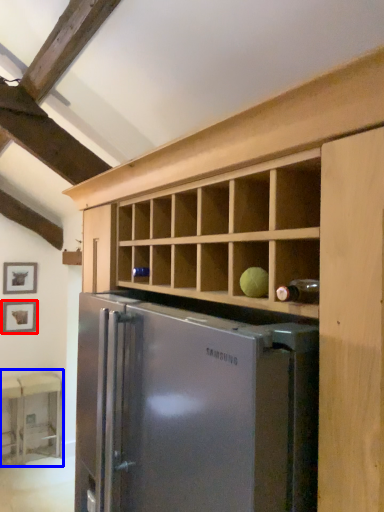
Question: Among these objects, which one is farthest to the camera, picture frame (highlighted by a red box) or table (highlighted by a blue box)?

Choices:
 (A) picture frame
 (B) table

Answer: (A)